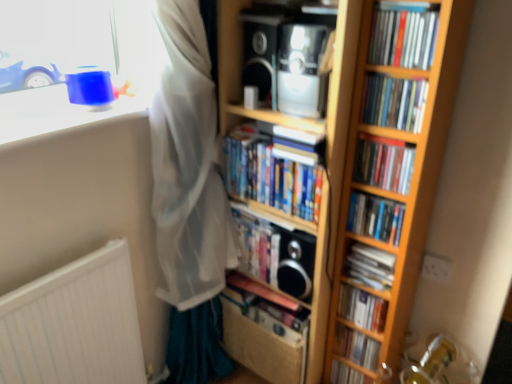
Question: Is hardcover book at center, placed as the 5th book when sorted from bottom to top, taller or shorter than satin black speaker at upper center, the 3th speaker when ordered from bottom to top?

Choices:
 (A) short
 (B) tall

Answer: (B)

Question: Is hardcover book at center, placed as the 5th book when sorted from bottom to top, inside the boundaries of satin black speaker at upper center, the 3th speaker when ordered from bottom to top, or outside?

Choices:
 (A) inside
 (B) outside

Answer: (B)

Question: Considering the real-world distances, which object is closest to the hardcover book at center, which ranks as the 6th book in bottom-to-top order?

Choices:
 (A) hardcover books at center, which is the 3th book in top-to-bottom order
 (B) hardcover books at center, the 4th book when ordered from top to bottom
 (C) matte black book at right, marked as the 4th book in a bottom-to-top arrangement
 (D) hardcover book at center, which is counted as the ninth book, starting from the top
 (E) hardcover book at center, the third book ordered from the bottom

Answer: (A)

Question: Estimate the real-world distances between objects in this image. Which object is closer to the wooden bookcase at center?

Choices:
 (A) metallic silver speaker at upper center, placed as the 2th speaker when sorted from top to bottom
 (B) matte plastic books at upper right, the tenth book from the bottom
 (C) satin black speaker at upper center, the 1th speaker positioned from the top
 (D) hardcover books at center, the eighth book when ordered from bottom to top
 (E) hardcover books at center, the 4th book when ordered from top to bottom

Answer: (E)